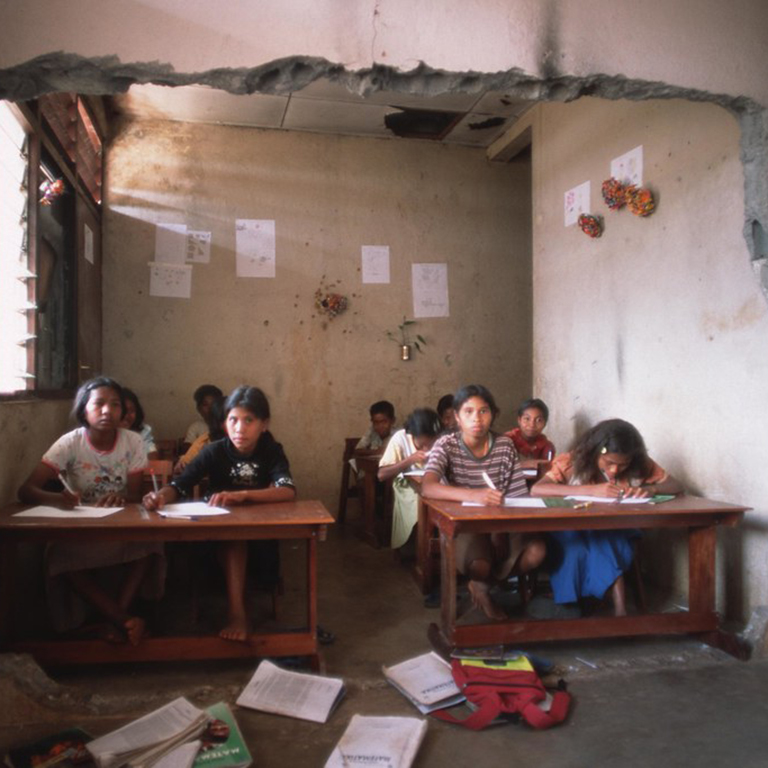
Where is `window`? The image size is (768, 768). window is located at coordinates (17, 323).